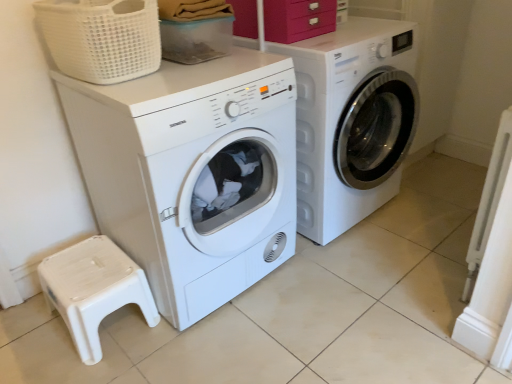
Question: From the image's perspective, is matte pink drawer at upper center on white woven basket at upper left?

Choices:
 (A) yes
 (B) no

Answer: (A)

Question: Does matte pink drawer at upper center have a smaller size compared to white woven basket at upper left?

Choices:
 (A) yes
 (B) no

Answer: (A)

Question: From a real-world perspective, is matte pink drawer at upper center positioned over white woven basket at upper left based on gravity?

Choices:
 (A) yes
 (B) no

Answer: (B)

Question: Is matte pink drawer at upper center facing away from white woven basket at upper left?

Choices:
 (A) yes
 (B) no

Answer: (B)

Question: Does matte pink drawer at upper center contain white woven basket at upper left?

Choices:
 (A) no
 (B) yes

Answer: (A)

Question: Can you confirm if matte pink drawer at upper center is thinner than white woven basket at upper left?

Choices:
 (A) no
 (B) yes

Answer: (B)

Question: Does white matte washing machine at left, which ranks as the first washing machine in left-to-right order, appear on the left side of matte pink drawer at upper center?

Choices:
 (A) no
 (B) yes

Answer: (B)

Question: From a real-world perspective, is white matte washing machine at left, which ranks as the first washing machine in left-to-right order, over matte pink drawer at upper center?

Choices:
 (A) no
 (B) yes

Answer: (A)

Question: From the image's perspective, is white matte washing machine at left, the 2th washing machine positioned from the right, on top of matte pink drawer at upper center?

Choices:
 (A) yes
 (B) no

Answer: (B)

Question: Could you tell me if white matte washing machine at left, the 2th washing machine positioned from the right, is turned towards matte pink drawer at upper center?

Choices:
 (A) yes
 (B) no

Answer: (B)

Question: Is white matte washing machine at left, which ranks as the first washing machine in left-to-right order, bigger than matte pink drawer at upper center?

Choices:
 (A) yes
 (B) no

Answer: (A)

Question: Is white matte washing machine at left, which ranks as the first washing machine in left-to-right order, facing away from matte pink drawer at upper center?

Choices:
 (A) no
 (B) yes

Answer: (A)

Question: Does white matte washing machine at left, the 2th washing machine positioned from the right, touch white plastic step stool at lower left?

Choices:
 (A) no
 (B) yes

Answer: (A)